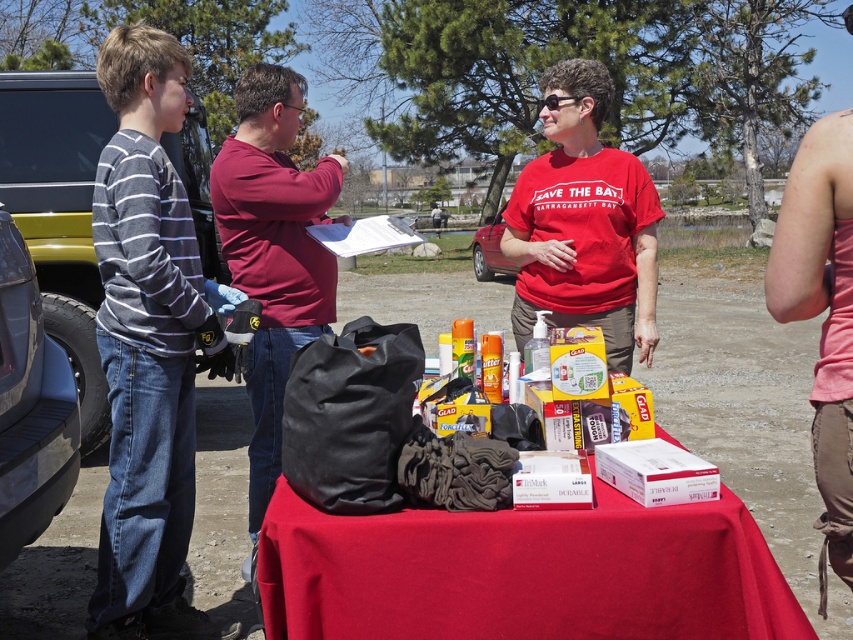
Question: Which object is the closest to the pink fabric tank top at center?

Choices:
 (A) maroon cotton shirt at center
 (B) rubberized black bag at center
 (C) matte red t-shirt at center

Answer: (B)

Question: Which object is farther from the camera taking this photo?

Choices:
 (A) matte red t-shirt at center
 (B) maroon cotton shirt at center
 (C) pink fabric tank top at center

Answer: (B)

Question: Can you confirm if matte red t-shirt at center is wider than pink fabric tank top at center?

Choices:
 (A) no
 (B) yes

Answer: (B)

Question: Is gray striped sweater at left positioned behind maroon cotton shirt at center?

Choices:
 (A) no
 (B) yes

Answer: (A)

Question: Observing the image, what is the correct spatial positioning of maroon cotton shirt at center in reference to pink fabric tank top at center?

Choices:
 (A) left
 (B) right

Answer: (A)

Question: Which point is farther to the camera?

Choices:
 (A) (845, 317)
 (B) (593, 161)
 (C) (128, 381)

Answer: (B)